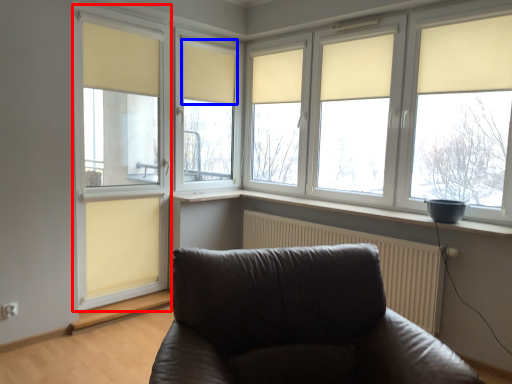
Question: Which of the following is the closest to the observer, glass door (highlighted by a red box) or curtain (highlighted by a blue box)?

Choices:
 (A) glass door
 (B) curtain

Answer: (A)